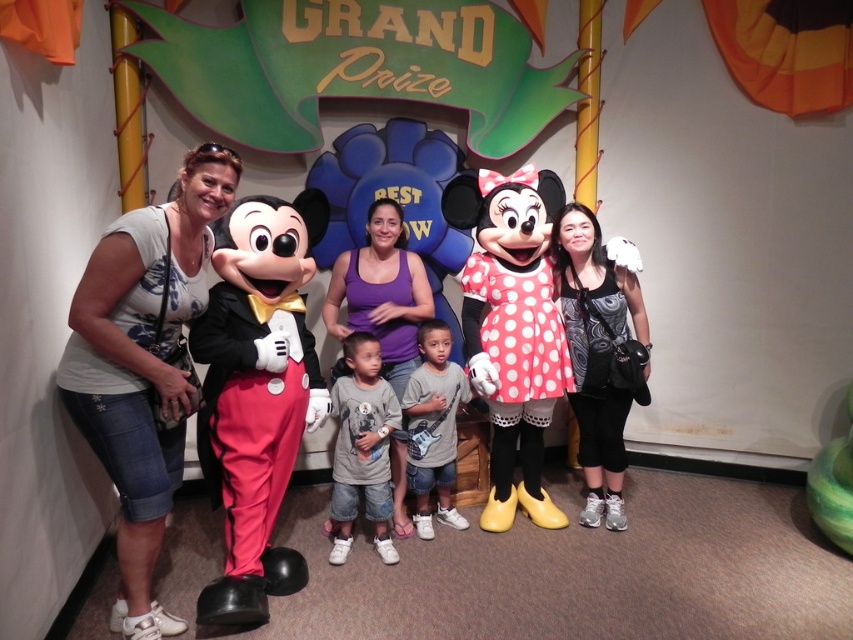
Who is shorter, purple fabric tank top at center or gray cotton shirt at center?

gray cotton shirt at center

Between purple fabric tank top at center and gray cotton shirt at center, which one is positioned higher?

purple fabric tank top at center

Does point (424, 273) come farther from viewer compared to point (341, 472)?

Yes, point (424, 273) is farther from viewer.

At what (x,y) coordinates should I click in order to perform the action: click on purple fabric tank top at center. Please return your answer as a coordinate pair (x, y). The width and height of the screenshot is (853, 640). Looking at the image, I should click on (381, 292).

Is white printed t-shirt at left further to the viewer compared to purple fabric tank top at center?

No.

Is point (155, 504) positioned behind point (392, 198)?

No, it is in front of (392, 198).

Where is `white printed t-shirt at left`? white printed t-shirt at left is located at coordinates (143, 365).

Between point (390, 499) and point (451, 508), which one is positioned behind?

Point (451, 508)

Does point (351, 440) lie behind point (451, 392)?

That is False.

The image size is (853, 640). What are the coordinates of `gray cotton shirt at center` in the screenshot? It's located at (361, 449).